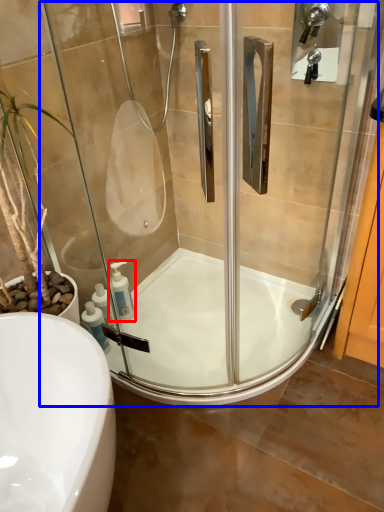
Question: Among these objects, which one is nearest to the camera, soap dispenser (highlighted by a red box) or screen door (highlighted by a blue box)?

Choices:
 (A) soap dispenser
 (B) screen door

Answer: (B)